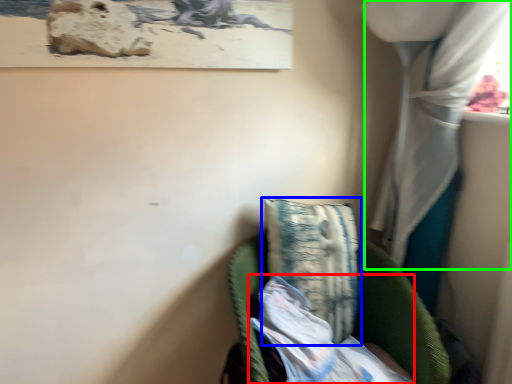
Question: Which object is the closest to the wrapping paper (highlighted by a red box)? Choose among these: pillow (highlighted by a blue box) or curtain (highlighted by a green box).

Choices:
 (A) pillow
 (B) curtain

Answer: (A)